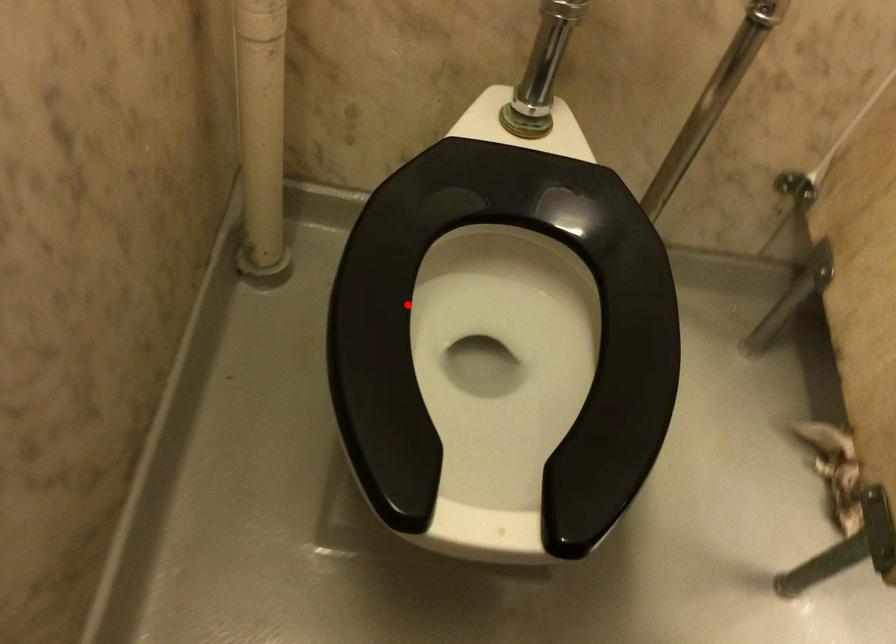
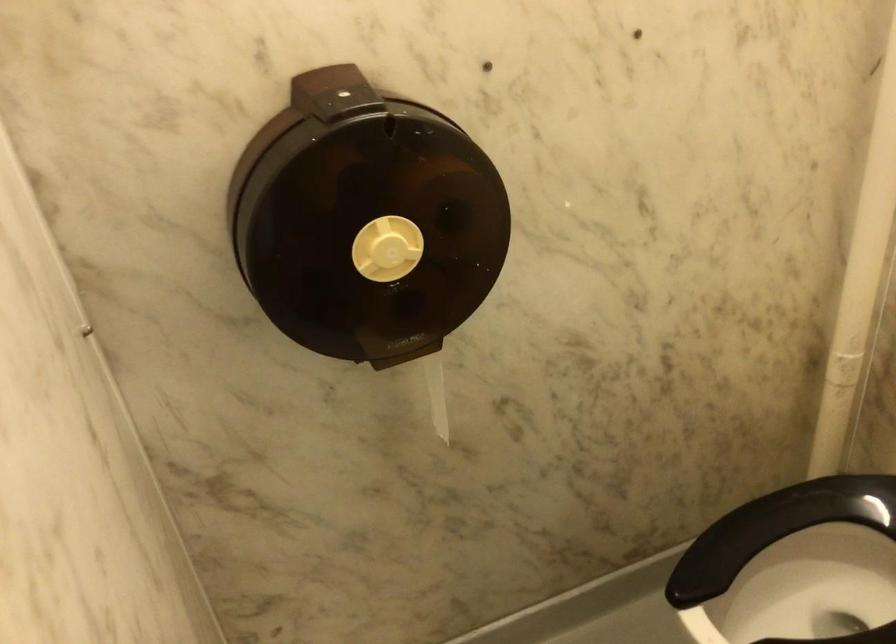
In the second image, find the point that corresponds to the highlighted location in the first image.

(780, 536)